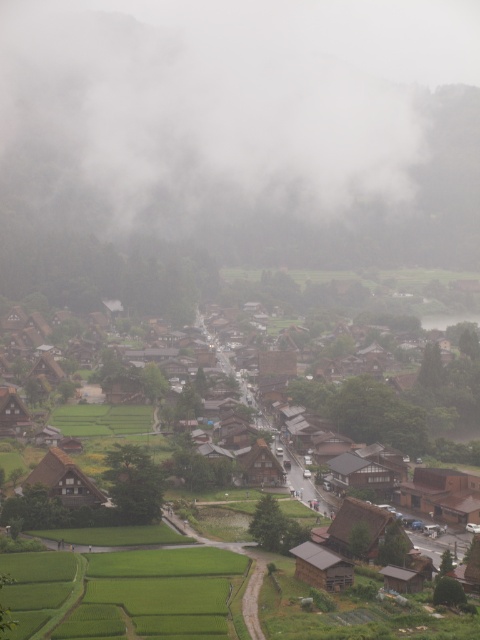
You are a traveler standing at the entrance of the village and want to visit the largest brown wooden hut. Which one should you head towards, the brown wooden hut at center or the brown wooden hut at lower left?

The brown wooden hut at center is larger in size compared to the brown wooden hut at lower left, so you should head towards the brown wooden hut at center.

You are a tourist standing at the entrance of the village and want to take a photo of both the brown wooden hut at center and the brown wooden hut at lower left. Which direction should you face to ensure both are visible in your camera frame?

To capture both the brown wooden hut at center and the brown wooden hut at lower left in your photo, you should face towards the right side of the village. Since the brown wooden hut at center is positioned to the right of the brown wooden hut at lower left, facing right will allow both huts to be within your camera frame.

You are a delivery person trying to navigate through the narrow road between the brown wooden hut at center and the brown wooden hut at lower left. Can you pass through the space between them?

The brown wooden hut at center might be wider than brown wooden hut at lower left, so it is uncertain if there is enough space to pass through the narrow road between them. Proceed with caution.